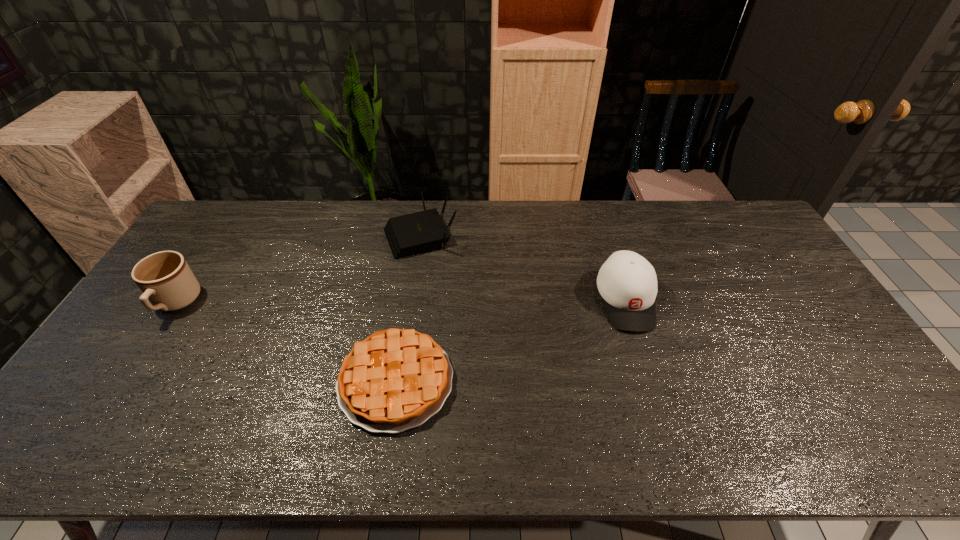
This screenshot has width=960, height=540. I want to click on object present at the far edge, so click(419, 232).

I want to click on object that is positioned at the near edge, so click(x=396, y=379).

Locate an element on the screen. object that is at the left edge is located at coordinates (165, 278).

At what (x,y) coordinates should I click in order to perform the action: click on vacant space at the far edge. Please return your answer as a coordinate pair (x, y). Looking at the image, I should click on (260, 205).

Locate an element on the screen. This screenshot has height=540, width=960. vacant space at the left edge is located at coordinates (211, 275).

Image resolution: width=960 pixels, height=540 pixels. Find the location of `free point at the right edge`. free point at the right edge is located at coordinates (852, 366).

Image resolution: width=960 pixels, height=540 pixels. In the image, there is a desktop. In order to click on blank space at the far left corner in this screenshot , I will do `click(226, 223)`.

You are a GUI agent. You are given a task and a screenshot of the screen. Output one action in this format:
    pyautogui.click(x=<x>, y=<y>)
    Task: Click on the vacant region at the near right corner of the desktop
    The height and width of the screenshot is (540, 960).
    Given the screenshot: What is the action you would take?
    pyautogui.click(x=898, y=440)

This screenshot has height=540, width=960. Identify the location of vacant region between the pie and the leftmost object. (286, 342).

Where is `unoccupied area between the nearest object and the second shortest object`? Image resolution: width=960 pixels, height=540 pixels. unoccupied area between the nearest object and the second shortest object is located at coordinates (408, 308).